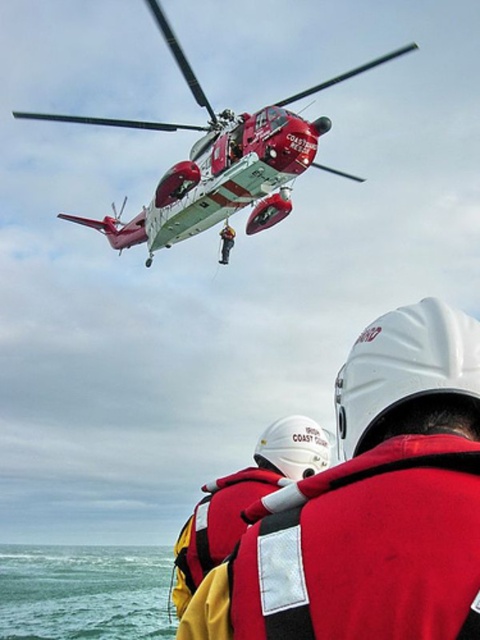
Can you confirm if green water at lower left is shorter than red life vest at lower center?

In fact, green water at lower left may be taller than red life vest at lower center.

Is green water at lower left positioned at the back of red life vest at lower center?

Yes, green water at lower left is further from the viewer.

Locate an element on the screen. This screenshot has height=640, width=480. green water at lower left is located at coordinates (84, 593).

Image resolution: width=480 pixels, height=640 pixels. In order to click on green water at lower left in this screenshot , I will do `click(84, 593)`.

Between white hard hat at upper center and green water at lower left, which one is positioned lower?

green water at lower left is lower down.

Who is more forward, (321, 627) or (82, 563)?

Positioned in front is point (321, 627).

Is point (411, 528) in front of point (165, 579)?

Yes, it is in front of point (165, 579).

Find the location of `white hard hat at upper center`. white hard hat at upper center is located at coordinates (371, 504).

At what (x,y) coordinates should I click in order to perform the action: click on white hard hat at upper center. Please return your answer as a coordinate pair (x, y). This screenshot has width=480, height=640. Looking at the image, I should click on (371, 504).